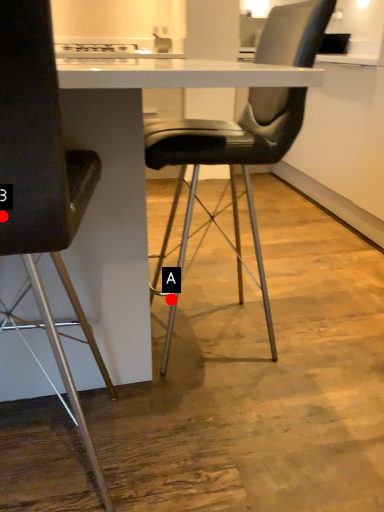
Question: Two points are circled on the image, labeled by A and B beside each circle. Which point appears farthest from the camera in this image?

Choices:
 (A) A is further
 (B) B is further

Answer: (A)